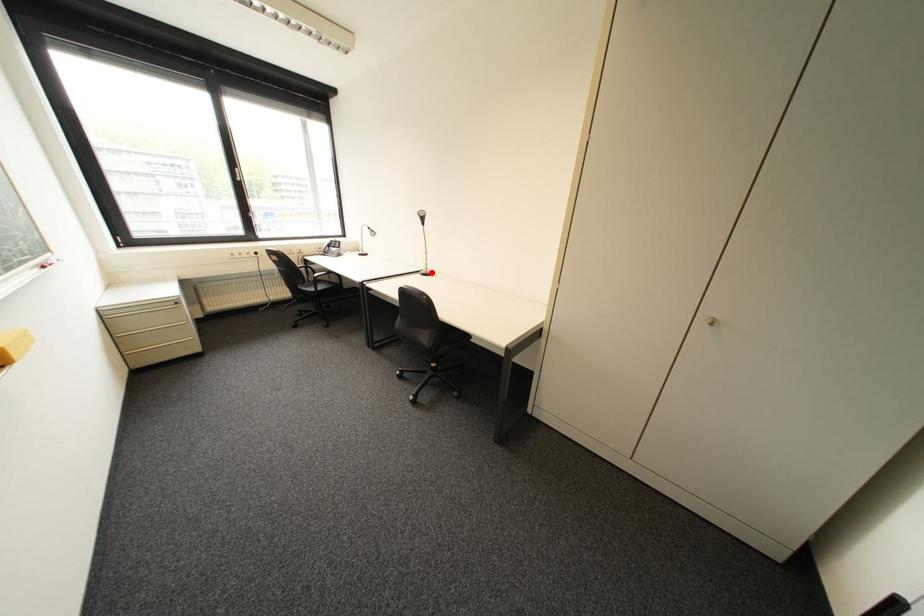
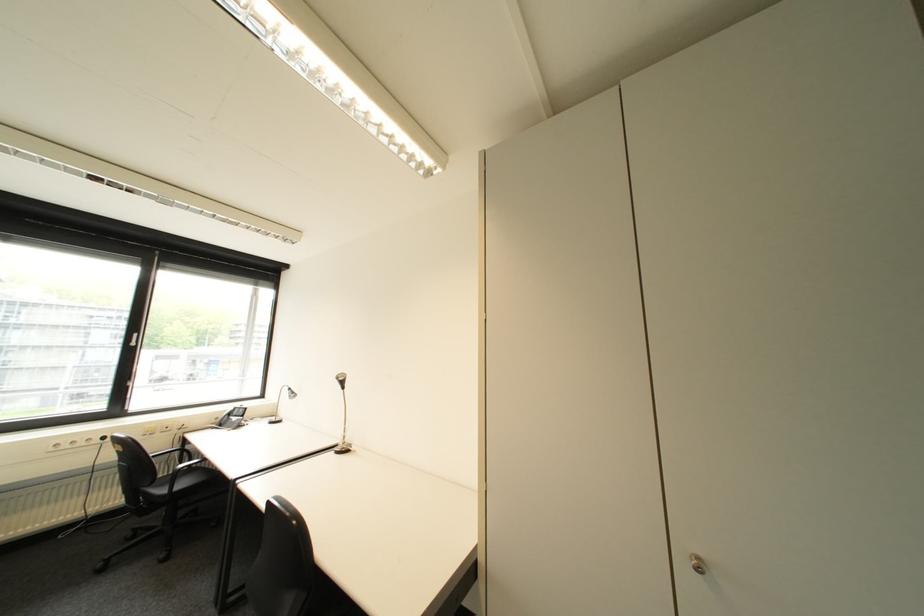
Question: I am providing you with two images of the same scene from different viewpoints. Image1 has a red point marked. In image2, the corresponding 3D location appears at what relative position? Reply with the corresponding letter.

Choices:
 (A) Closer
 (B) Farther

Answer: (B)